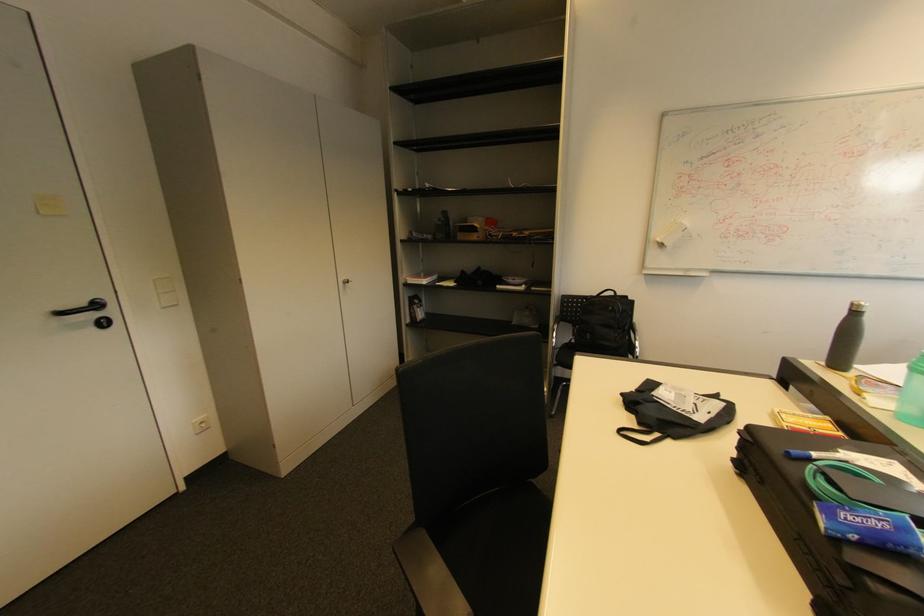
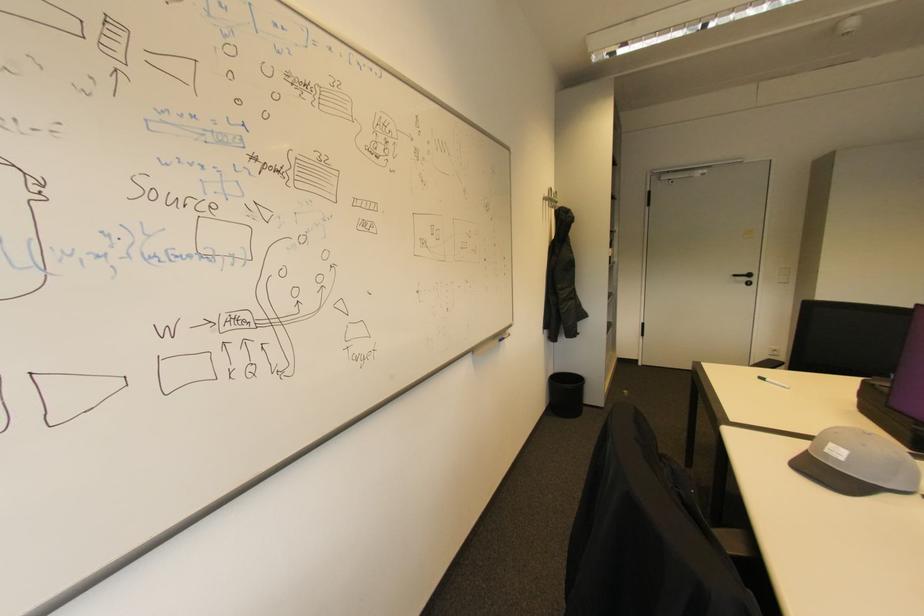
Where in the second image is the point corresponding to (103,305) from the first image?

(755, 276)